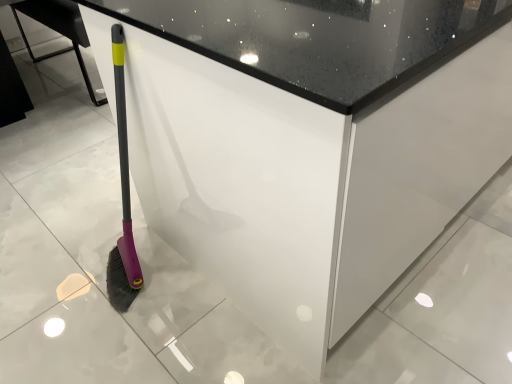
Image resolution: width=512 pixels, height=384 pixels. What are the coordinates of `matte plastic broom at left` in the screenshot? It's located at (58, 30).

Describe the element at coordinates (58, 30) in the screenshot. The image size is (512, 384). I see `matte plastic broom at left` at that location.

Where is `matte plastic broom at left`? This screenshot has width=512, height=384. matte plastic broom at left is located at coordinates click(x=58, y=30).